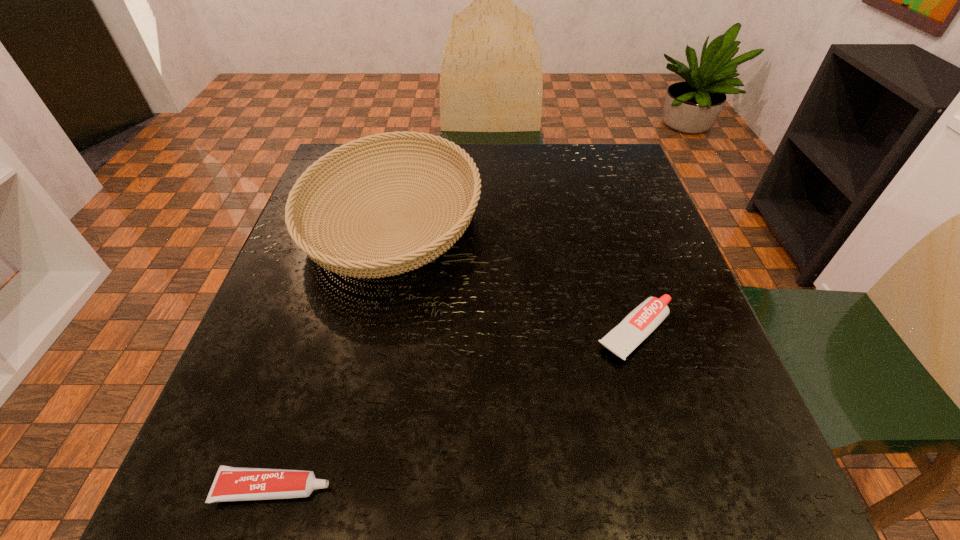
This screenshot has height=540, width=960. Find the location of `basket`. basket is located at coordinates (406, 257).

I want to click on the tallest object, so click(x=406, y=257).

In order to click on the right toothpaste in this screenshot , I will do `click(644, 319)`.

Find the location of a particular element. Image resolution: width=960 pixels, height=540 pixels. the second nearest object is located at coordinates tap(644, 319).

Locate an element on the screen. The width and height of the screenshot is (960, 540). the nearer toothpaste is located at coordinates (231, 483).

What are the coordinates of `the nearest object` in the screenshot? It's located at (231, 483).

The image size is (960, 540). I want to click on vacant region located 0.330m on the front of the farthest object, so click(x=336, y=480).

The image size is (960, 540). In order to click on free space located 0.250m on the back of the taller toothpaste in this screenshot , I will do `click(601, 219)`.

This screenshot has width=960, height=540. Find the location of `free space located at the nozzle of the shorter toothpaste`. free space located at the nozzle of the shorter toothpaste is located at coordinates (534, 488).

Locate an element on the screen. This screenshot has width=960, height=540. object at the far edge is located at coordinates (406, 257).